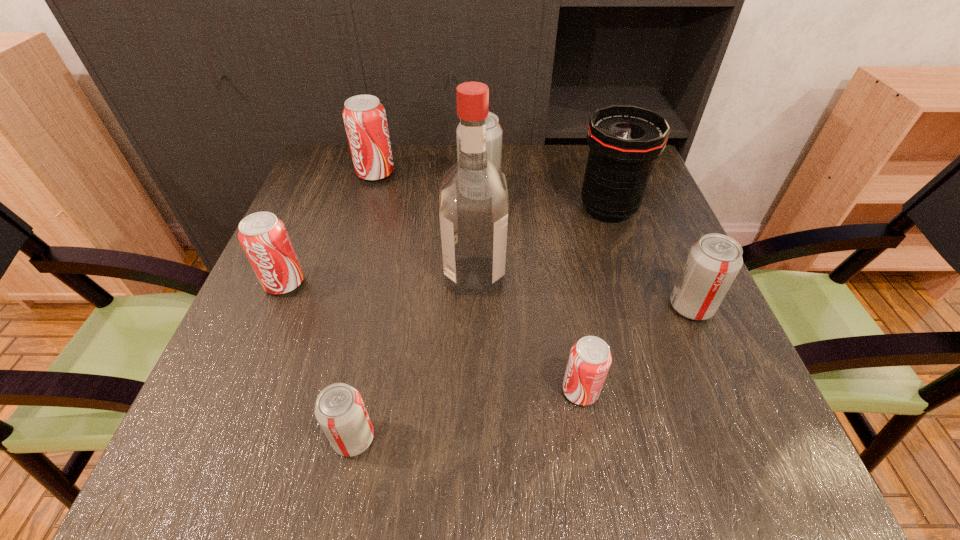
What are the coordinates of `the tallest object` in the screenshot? It's located at (473, 204).

Find the location of a particular element. This screenshot has height=540, width=960. telephoto lens is located at coordinates (624, 141).

Where is `the farthest red soda can`? the farthest red soda can is located at coordinates (364, 117).

Where is `the second soda can from left to right`? the second soda can from left to right is located at coordinates (364, 117).

Image resolution: width=960 pixels, height=540 pixels. What are the coordinates of `the second gray soda can from left to right` in the screenshot? It's located at (493, 131).

This screenshot has width=960, height=540. Identify the location of the farthest gray soda can. tap(493, 131).

You are a GUI agent. You are given a task and a screenshot of the screen. Output one action in this format:
    pyautogui.click(x=<x>, y=<y>)
    Task: Click on the rightmost gray soda can
    
    Given the screenshot: What is the action you would take?
    pyautogui.click(x=713, y=262)

The width and height of the screenshot is (960, 540). In order to click on the second nearest gray soda can in this screenshot , I will do `click(713, 262)`.

Identify the location of the second nearest red soda can. (264, 238).

At what (x,y) coordinates should I click in order to perform the action: click on the second biggest red soda can. Please return your answer as a coordinate pair (x, y). Looking at the image, I should click on (264, 238).